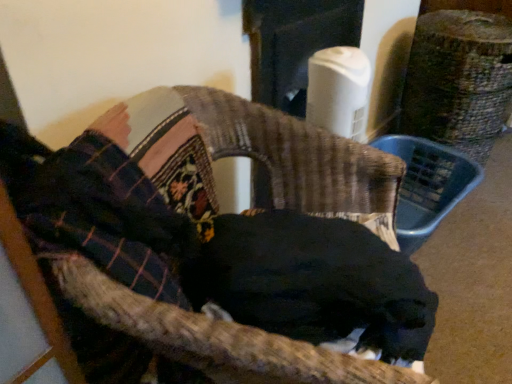
In order to face black fur dog at center, should I rotate leftwards or rightwards?

To align with it, rotate right about 9.336°.

This screenshot has height=384, width=512. Describe the element at coordinates (101, 211) in the screenshot. I see `plaid fabric at upper left` at that location.

Locate an element on the screen. The image size is (512, 384). woven fabric chair at center is located at coordinates (231, 220).

Is woven fabric chair at center facing towards black fur dog at center?

Yes, woven fabric chair at center is turned towards black fur dog at center.

Locate an element on the screen. This screenshot has width=512, height=384. dog lying on the right of woven fabric chair at center is located at coordinates (314, 282).

From a real-world perspective, is woven fabric chair at center under black fur dog at center?

Yes, from a real-world perspective, woven fabric chair at center is under black fur dog at center.

Is woven fabric chair at center to the left or to the right of black fur dog at center in the image?

From the image, it's evident that woven fabric chair at center is to the left of black fur dog at center.

Considering the sizes of black fur dog at center and woven fabric chair at center in the image, is black fur dog at center bigger or smaller than woven fabric chair at center?

In the image, black fur dog at center appears to be smaller than woven fabric chair at center.

Which object is positioned more to the right, black fur dog at center or woven fabric chair at center?

From the viewer's perspective, black fur dog at center appears more on the right side.

Considering the sizes of objects black fur dog at center and woven fabric chair at center in the image provided, who is thinner, black fur dog at center or woven fabric chair at center?

black fur dog at center.

Can you confirm if black fur dog at center is shorter than woven fabric chair at center?

Yes.

You are a GUI agent. You are given a task and a screenshot of the screen. Output one action in this format:
    pyautogui.click(x=<x>, y=<y>)
    Task: Click on the clothing above the woven fabric chair at center (from a real-world perspective)
    This screenshot has height=384, width=512.
    Given the screenshot: What is the action you would take?
    coord(101,211)

Is woven fabric chair at center situated inside plaid fabric at upper left or outside?

woven fabric chair at center cannot be found inside plaid fabric at upper left.

From the picture: Is woven fabric chair at center smaller than plaid fabric at upper left?

Incorrect, woven fabric chair at center is not smaller in size than plaid fabric at upper left.

Which of these two, woven fabric chair at center or plaid fabric at upper left, is wider?

woven fabric chair at center.

Can you confirm if plaid fabric at upper left is smaller than woven fabric chair at center?

Correct, plaid fabric at upper left occupies less space than woven fabric chair at center.

Between plaid fabric at upper left and woven fabric chair at center, which one has more height?

woven fabric chair at center.

Which is nearer, (28, 155) or (401, 168)?

The point (28, 155) is closer to the camera.

In the scene shown: Which is more to the right, plaid fabric at upper left or woven fabric chair at center?

woven fabric chair at center.

Could you tell me if plaid fabric at upper left is turned towards black fur dog at center?

Yes, plaid fabric at upper left is oriented towards black fur dog at center.

Which object is positioned more to the left, plaid fabric at upper left or black fur dog at center?

plaid fabric at upper left.

Is plaid fabric at upper left inside or outside of black fur dog at center?

plaid fabric at upper left is spatially situated outside black fur dog at center.

From the picture: Which of these two, plaid fabric at upper left or black fur dog at center, is smaller?

plaid fabric at upper left is smaller.

From a real-world perspective, which object rests below the other?

In real-world perspective, black fur dog at center is lower.

Measure the distance from black fur dog at center to plaid fabric at upper left.

black fur dog at center and plaid fabric at upper left are 7.84 inches apart from each other.

Does black fur dog at center come in front of plaid fabric at upper left?

No, black fur dog at center is behind plaid fabric at upper left.

Find the location of `dog behind the woven fabric chair at center`. dog behind the woven fabric chair at center is located at coordinates pyautogui.click(x=314, y=282).

Where is `dog on the right side of woven fabric chair at center`? Image resolution: width=512 pixels, height=384 pixels. dog on the right side of woven fabric chair at center is located at coordinates (314, 282).

Looking at the image, which one is located further to woven fabric chair at center, plaid fabric at upper left or black fur dog at center?

The object further to woven fabric chair at center is plaid fabric at upper left.

Based on their spatial positions, is woven fabric chair at center or plaid fabric at upper left further from black fur dog at center?

Among the two, plaid fabric at upper left is located further to black fur dog at center.

From the picture: When comparing their distances from black fur dog at center, does plaid fabric at upper left or woven fabric chair at center seem further?

plaid fabric at upper left is further to black fur dog at center.

Which object lies further to the anchor point woven fabric chair at center, black fur dog at center or plaid fabric at upper left?

plaid fabric at upper left is positioned further to the anchor woven fabric chair at center.

When comparing their distances from plaid fabric at upper left, does woven fabric chair at center or black fur dog at center seem further?

black fur dog at center.

From the image, which object appears to be nearer to plaid fabric at upper left, black fur dog at center or woven fabric chair at center?

Among the two, woven fabric chair at center is located nearer to plaid fabric at upper left.

This screenshot has width=512, height=384. I want to click on chair between plaid fabric at upper left and black fur dog at center, so click(x=231, y=220).